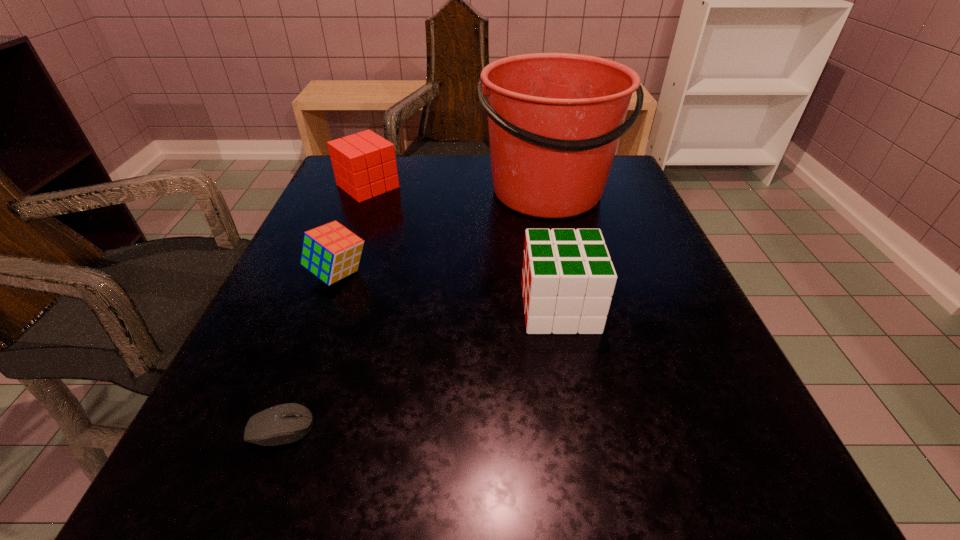
Where is `the tallest object`? The height and width of the screenshot is (540, 960). the tallest object is located at coordinates (555, 119).

I want to click on the rightmost cube, so click(568, 279).

The image size is (960, 540). Identify the location of the farthest cube. (364, 164).

Where is `computer equipment`? Image resolution: width=960 pixels, height=540 pixels. computer equipment is located at coordinates (286, 423).

The height and width of the screenshot is (540, 960). Identify the location of the nearest object. (286, 423).

The height and width of the screenshot is (540, 960). What are the coordinates of `vacant space located on the left of the tallest object` in the screenshot? It's located at (430, 191).

Where is `vacant area situated on the red face of the rightmost cube`? Image resolution: width=960 pixels, height=540 pixels. vacant area situated on the red face of the rightmost cube is located at coordinates (372, 308).

Find the location of a particular element. Image resolution: width=960 pixels, height=540 pixels. vacant point located on the red face of the rightmost cube is located at coordinates (426, 308).

The height and width of the screenshot is (540, 960). I want to click on vacant space located on the red face of the rightmost cube, so click(408, 308).

Where is `free space located 0.370m on the right of the farthest cube`? Image resolution: width=960 pixels, height=540 pixels. free space located 0.370m on the right of the farthest cube is located at coordinates (559, 186).